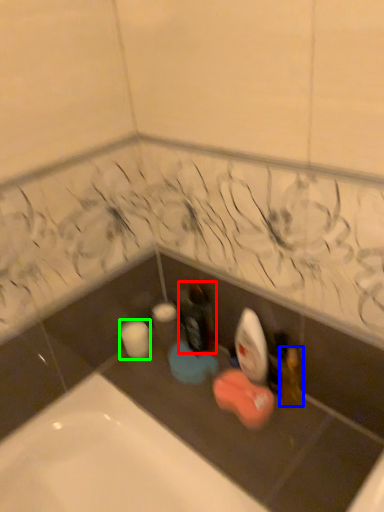
Question: Which object is the farthest from bottle (highlighted by a red box)? Choose among these: toiletry (highlighted by a blue box) or toilet paper (highlighted by a green box).

Choices:
 (A) toiletry
 (B) toilet paper

Answer: (A)